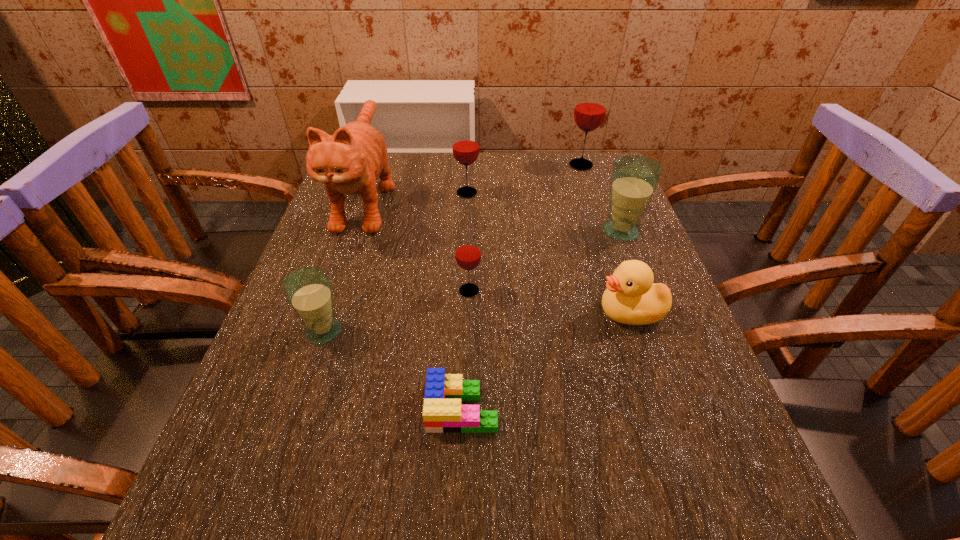
You are a GUI agent. You are given a task and a screenshot of the screen. Output one action in this format:
    pyautogui.click(x=<x>, y=<y>)
    Task: Click on the tallest object
    The image size is (960, 540).
    Given the screenshot: What is the action you would take?
    pyautogui.click(x=350, y=161)

You are a GUI agent. You are given a task and a screenshot of the screen. Output one action in this format:
    pyautogui.click(x=<x>, y=<y>)
    Task: Click on the ginger cat
    The image size is (960, 540).
    Given the screenshot: What is the action you would take?
    pyautogui.click(x=350, y=161)

The width and height of the screenshot is (960, 540). What are the coordinates of `the second tallest object` in the screenshot? It's located at (590, 108).

Identify the location of the tallest glass. (590, 108).

At what (x,y) coordinates should I click in order to perform the action: click on the fourth nearest glass. Please return your answer as a coordinate pair (x, y). This screenshot has height=540, width=960. Looking at the image, I should click on (465, 146).

Image resolution: width=960 pixels, height=540 pixels. Identify the location of the second biggest red glass. (465, 146).

The height and width of the screenshot is (540, 960). Identify the location of the right blue glass. (634, 179).

The height and width of the screenshot is (540, 960). Find the location of `the third nearest glass`. the third nearest glass is located at coordinates (634, 179).

Locate an element on the screen. The width and height of the screenshot is (960, 540). the nearest red glass is located at coordinates (468, 255).

Identify the location of the fourth farthest glass. (468, 255).